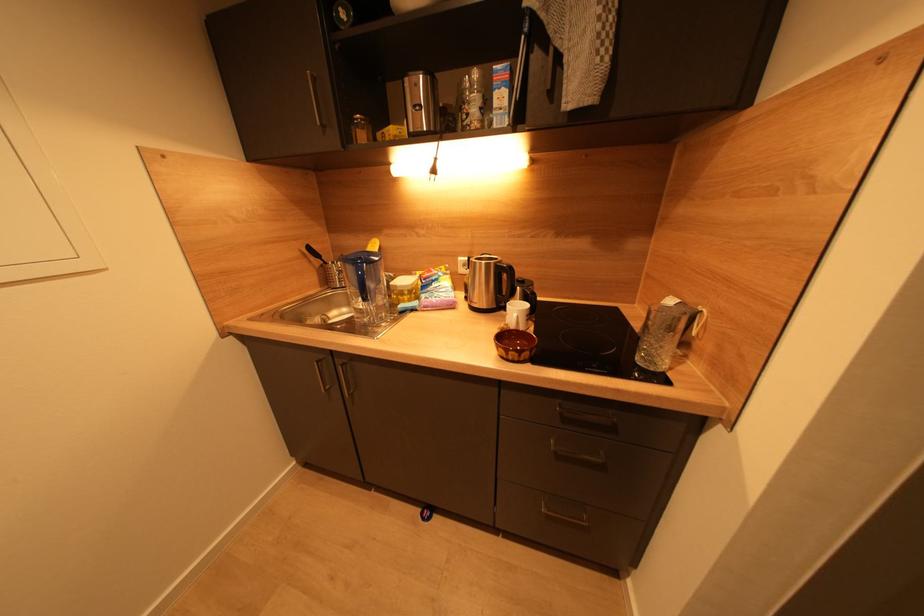
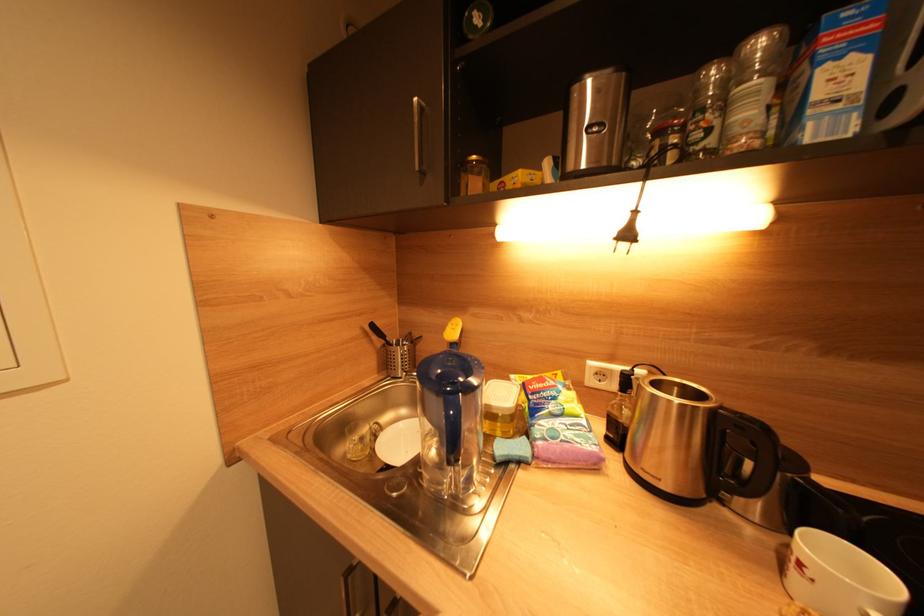
Question: How did the camera likely rotate?

Choices:
 (A) Left
 (B) Right
 (C) Up
 (D) Down

Answer: (A)